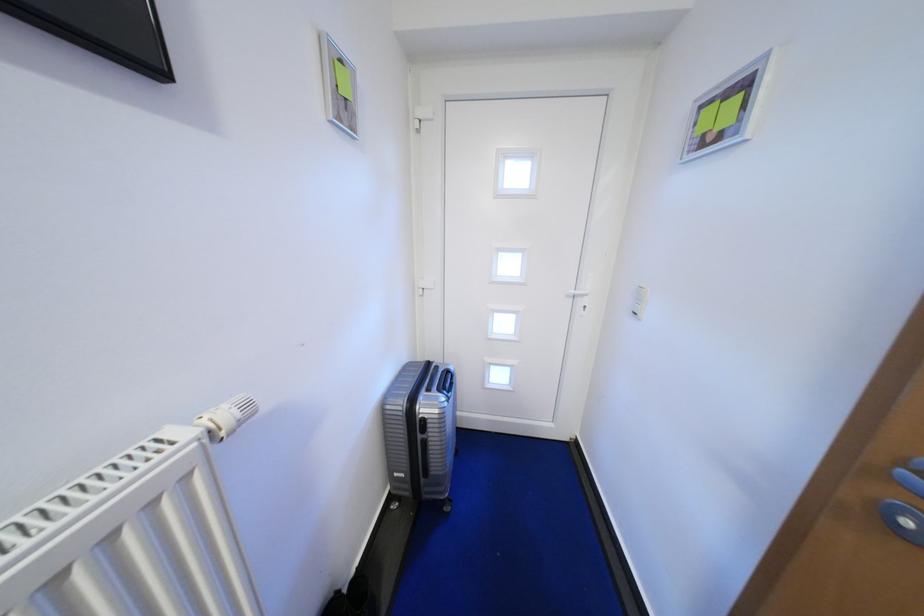
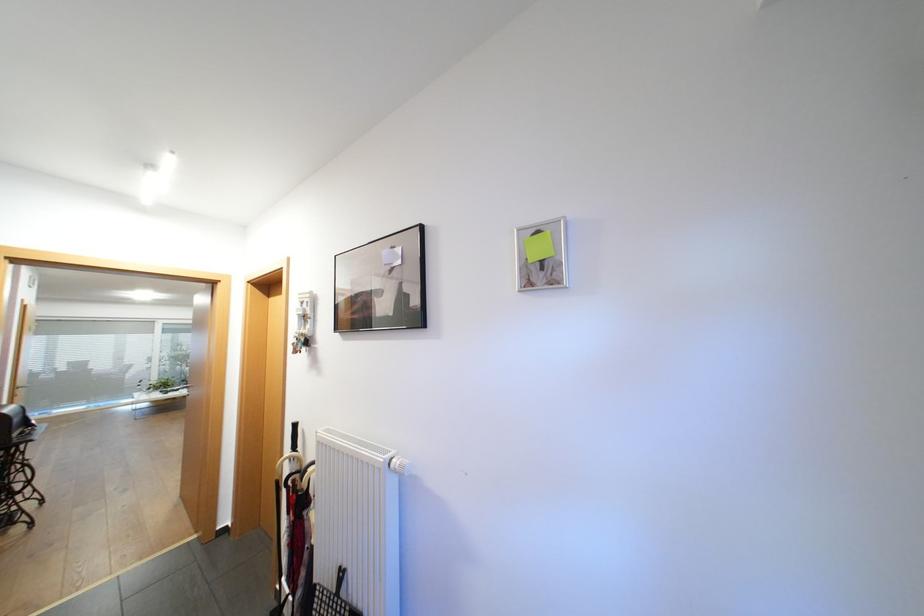
Question: I am providing you with two images of the same scene from different viewpoints. After the viewpoint changes to image2, which objects are now occluded?

Choices:
 (A) set of keys
 (B) white radiator knob
 (C) black umbrella handle
 (D) none of these

Answer: (D)